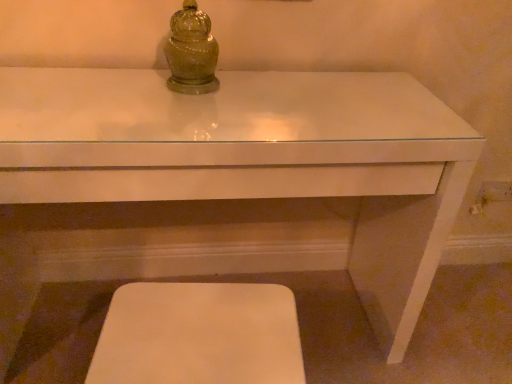
Where is `free area below green glass jar at upper center (from a real-world perspective)`? This screenshot has width=512, height=384. free area below green glass jar at upper center (from a real-world perspective) is located at coordinates (178, 86).